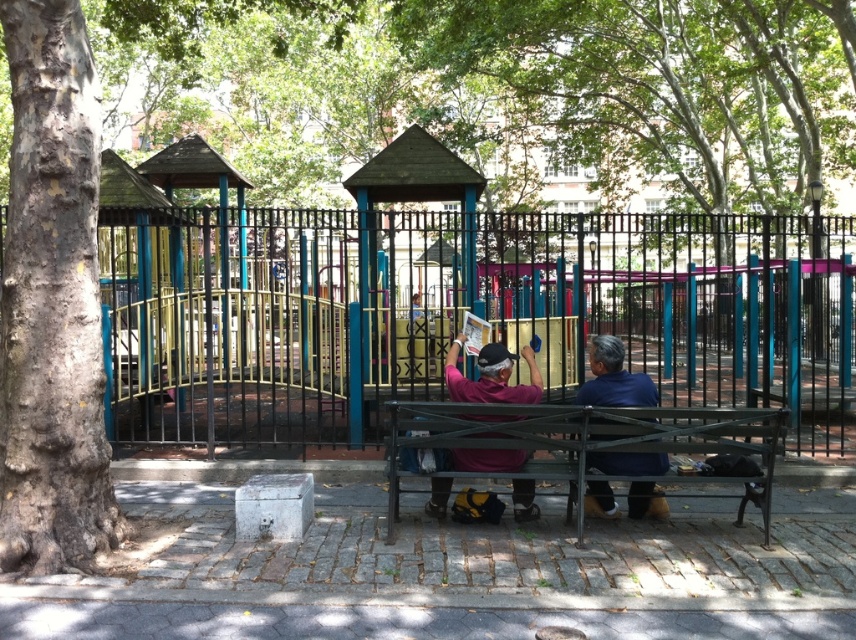
You are planning to place a new bench in the park. The current metallic green bench at center is next to the rough bark tree at left. Which object takes up more space in the image?

The metallic green bench at center occupies more space than the rough bark tree at left because the rough bark tree at left occupies less space than metallic green bench at center.

You are a delivery person with a cart that is 3 feet wide. You need to move from the rough bark tree at left to the metallic green bench at center. Is there enough space between them for your cart to pass through?

The rough bark tree at left and metallic green bench at center are 8.09 feet apart, so yes, the cart can pass through since the distance is greater than the cart width of 3 feet.

You are standing in the park and want to take a photo of the blue fabric shirt at center without the green leafy tree at center blocking the view. Is this possible?

The green leafy tree at center is further to the viewer than blue fabric shirt at center, so the tree is closer to you and would block the view of the shirt. Move closer to the shirt to avoid the tree blocking it.